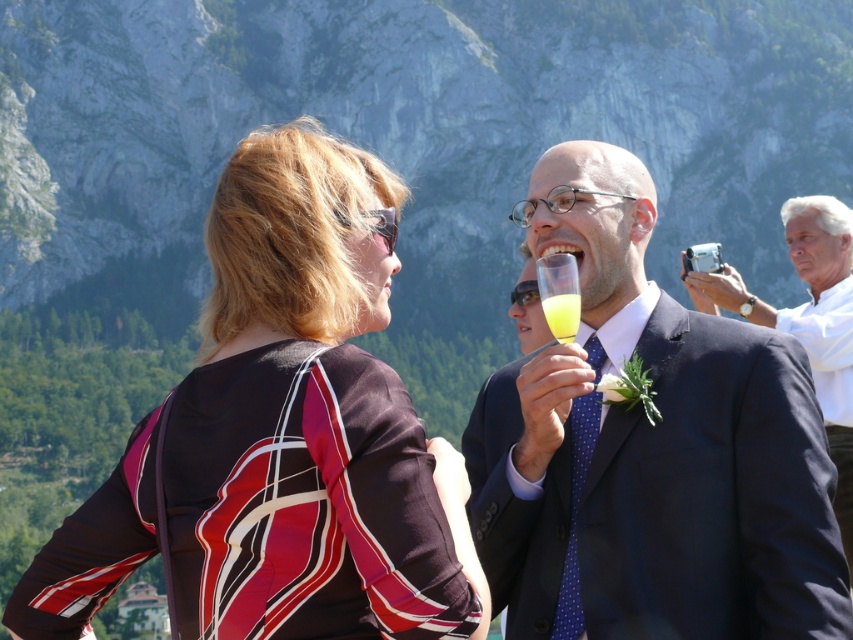
You are a photographer positioned at the white matte suit at upper right and need to capture a clear shot of the translucent glass at upper center. Given that your camera has a maximum focus range of 100 feet, will you be able to take the photo without moving closer?

The distance between the white matte suit at upper right and the translucent glass at upper center is 121.78 feet, which exceeds the camera maximum focus range of 100 feet. Therefore, you will not be able to take the photo without moving closer.

You are an artist planning to sketch this scene. You want to ensure that the rocky mountain at upper center and the printed silk blouse at upper left are proportionally accurate. Which object should you draw wider to maintain the correct proportions?

The rocky mountain at upper center should be drawn wider than the printed silk blouse at upper left because its width is larger according to the description.

You are a photographer at the event and need to capture a photo where both the matte black suit at center and the white matte suit at upper right are visible. Based on their positions, which suit is closer to the camera?

The white matte suit at upper right is closer to the camera because the matte black suit at center is positioned under it.